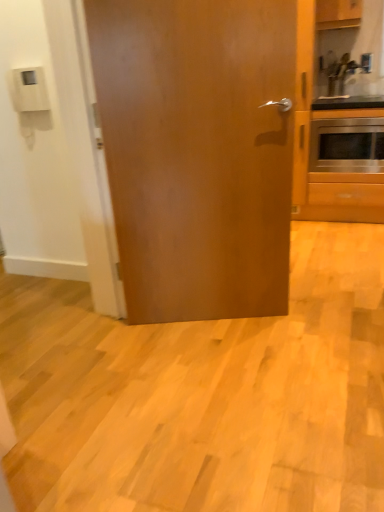
This screenshot has height=512, width=384. Identify the location of free space to the right of glossy wood door at center. (314, 317).